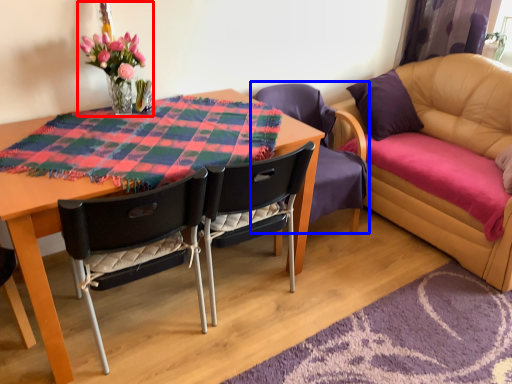
Question: Which point is further to the camera, floral arrangement (highlighted by a red box) or chair (highlighted by a blue box)?

Choices:
 (A) floral arrangement
 (B) chair

Answer: (B)